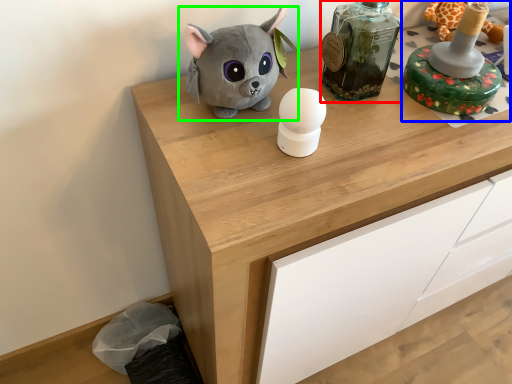
Question: Estimate the real-world distances between objects in this image. Which object is closer to bottle (highlighted by a red box), toy (highlighted by a blue box) or toy (highlighted by a green box)?

Choices:
 (A) toy
 (B) toy

Answer: (A)